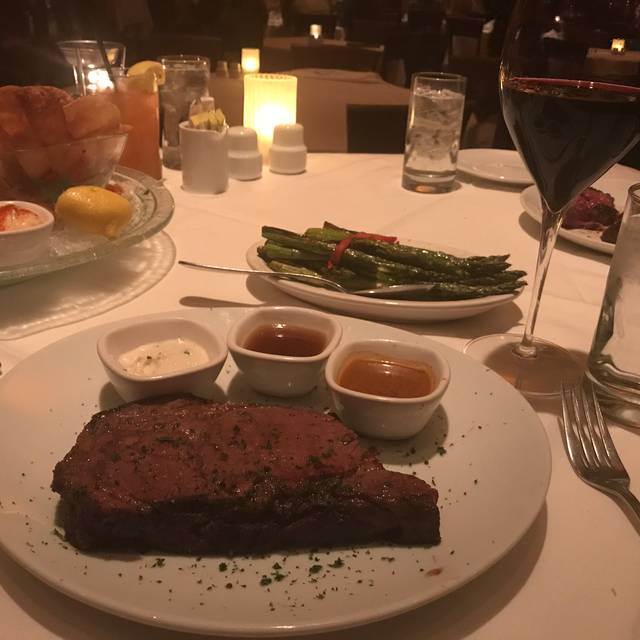
You are a GUI agent. You are given a task and a screenshot of the screen. Output one action in this format:
    pyautogui.click(x=<x>, y=<y>)
    Task: Click on the glass tumbler
    
    Given the screenshot: What is the action you would take?
    pyautogui.click(x=621, y=342)